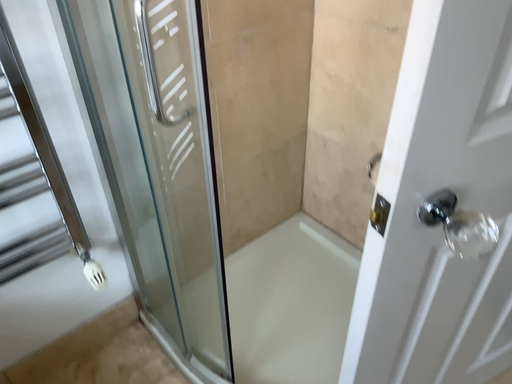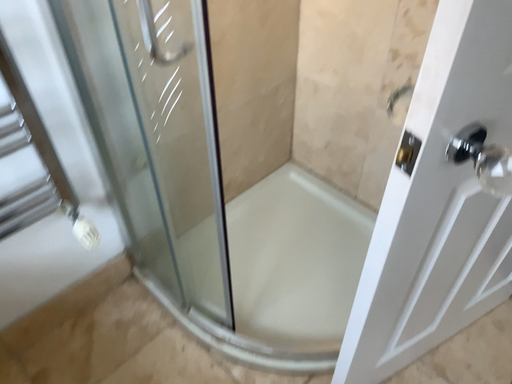
Question: Which way did the camera rotate in the video?

Choices:
 (A) rotated upward
 (B) rotated downward

Answer: (B)